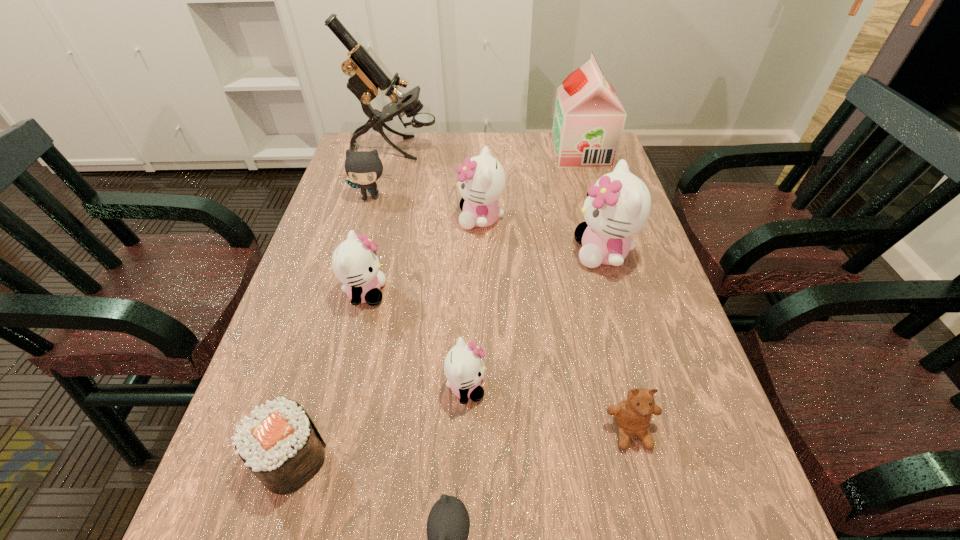
Image resolution: width=960 pixels, height=540 pixels. In order to click on the seventh farthest object in this screenshot , I will do `click(464, 369)`.

Image resolution: width=960 pixels, height=540 pixels. Identify the location of brown teddy bear. (633, 415).

Locate an element on the screen. Image resolution: width=960 pixels, height=540 pixels. sushi is located at coordinates (279, 443).

The width and height of the screenshot is (960, 540). Identify the location of free region located through the eyepiece of the microscope. (528, 148).

The height and width of the screenshot is (540, 960). I want to click on vacant space situated 0.180m with the cap open on the ninth shortest object, so click(499, 153).

Locate an element on the screen. This screenshot has height=540, width=960. vacant region located with the cap open on the ninth shortest object is located at coordinates (515, 153).

The height and width of the screenshot is (540, 960). In order to click on vacant space located with the cap open on the ninth shortest object in this screenshot , I will do `click(450, 153)`.

This screenshot has width=960, height=540. I want to click on vacant space located 0.140m on the front-facing side of the biggest white kitten, so click(x=517, y=252).

At what (x,y) coordinates should I click in order to perform the action: click on free space located on the front-facing side of the biggest white kitten. Please return your answer as a coordinate pair (x, y). The width and height of the screenshot is (960, 540). Looking at the image, I should click on (530, 252).

Where is `free space located 0.140m on the front-facing side of the biggest white kitten`? This screenshot has height=540, width=960. free space located 0.140m on the front-facing side of the biggest white kitten is located at coordinates (517, 252).